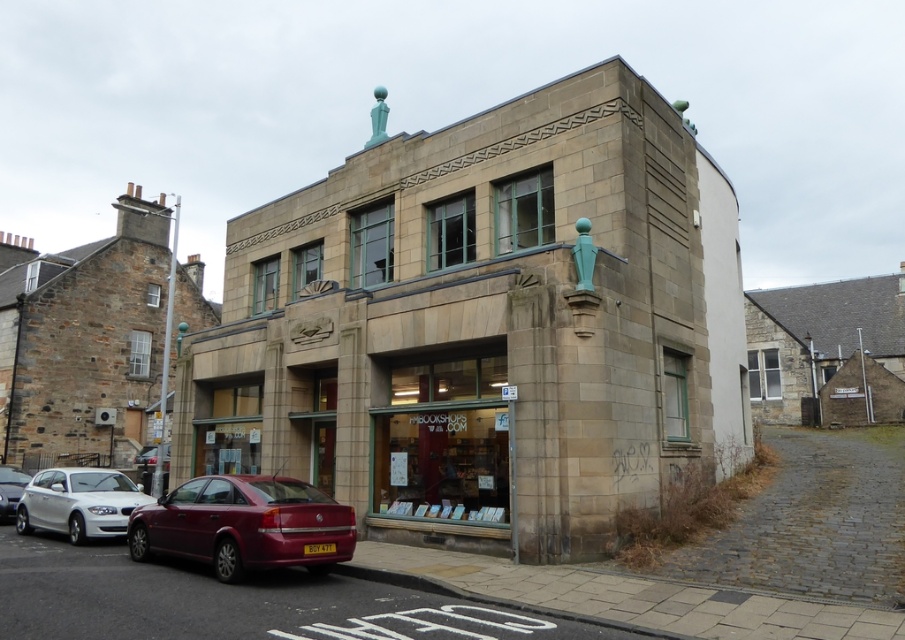
You are a delivery driver who needs to park your vehicle next to the building. You have a white matte car at lower left and a white glossy sedan at lower left. Which vehicle has more space between it and the building when parked side by side?

The white matte car at lower left has a larger width than the white glossy sedan at lower left, so when parked side by side, the white matte car at lower left will require more space between it and the building.

You are standing in front of the building and see two points marked on its facade. The first point is at coordinate (x=518, y=140) and the second is at (x=27, y=531). Which point is closer to you?

Point (x=518, y=140) is in front of point (x=27, y=531), so it is closer to you.